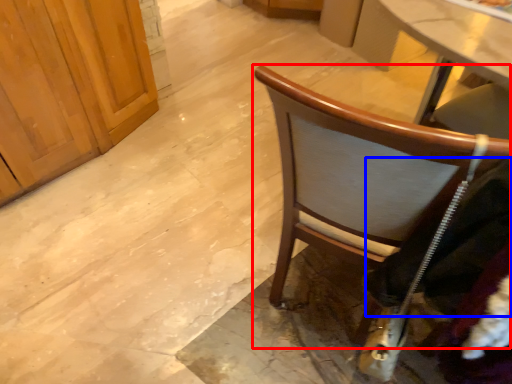
Question: Which of the following is the farthest to the observer, chair (highlighted by a red box) or clothing (highlighted by a blue box)?

Choices:
 (A) chair
 (B) clothing

Answer: (A)